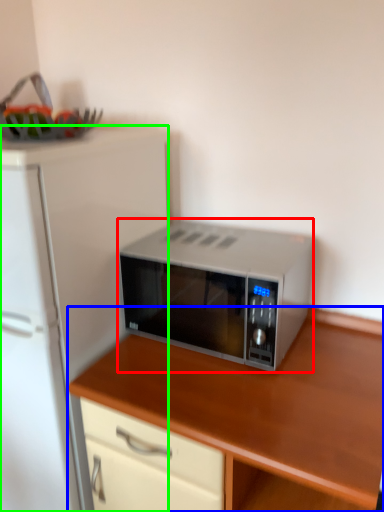
Question: Which object is the farthest from microwave oven (highlighted by a red box)? Choose among these: cabinetry (highlighted by a blue box) or refrigerator (highlighted by a green box).

Choices:
 (A) cabinetry
 (B) refrigerator

Answer: (B)